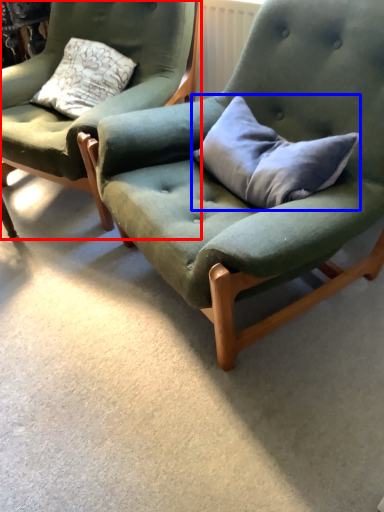
Question: Which of the following is the farthest to the observer, chair (highlighted by a red box) or pillow (highlighted by a blue box)?

Choices:
 (A) chair
 (B) pillow

Answer: (A)